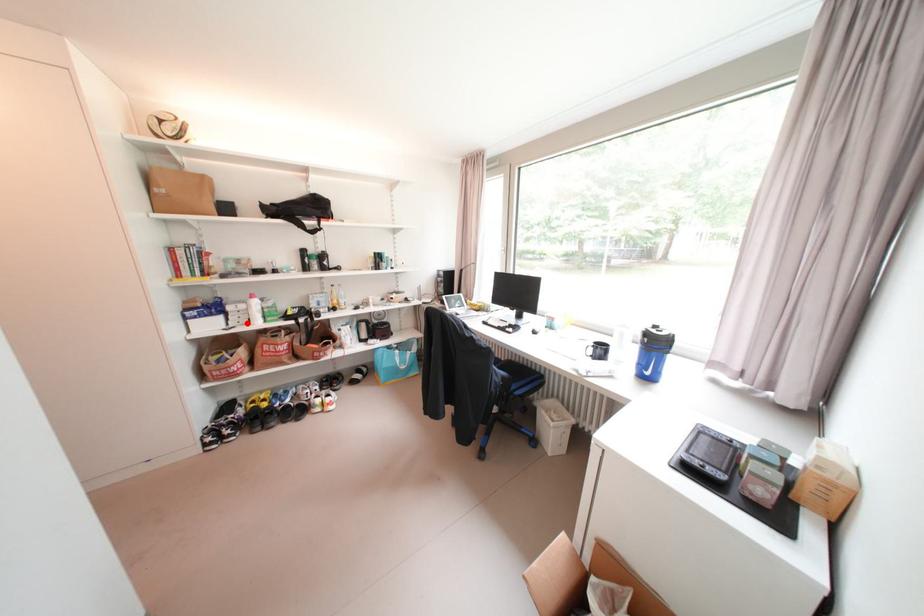
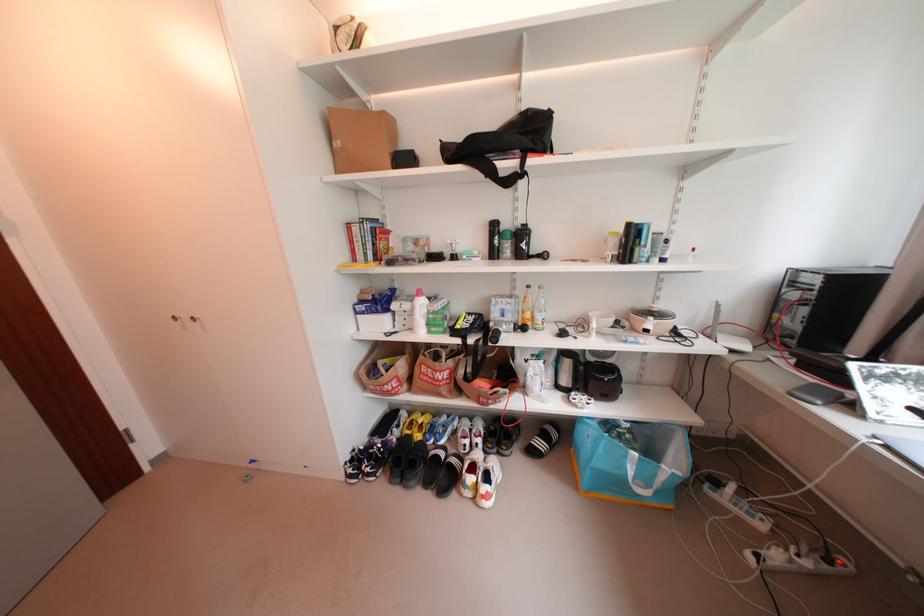
The point at the highlighted location is marked in the first image. Where is the corresponding point in the second image?

(412, 326)